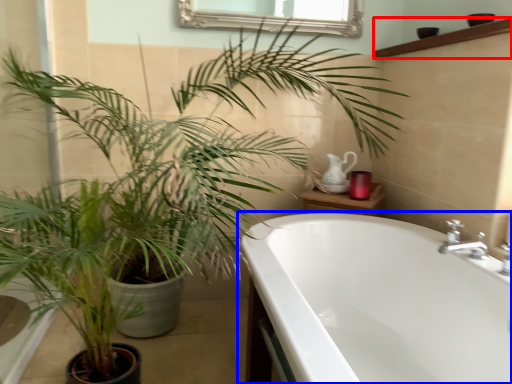
Question: Which point is closer to the camera, balustrade (highlighted by a red box) or bathtub (highlighted by a blue box)?

Choices:
 (A) balustrade
 (B) bathtub

Answer: (B)